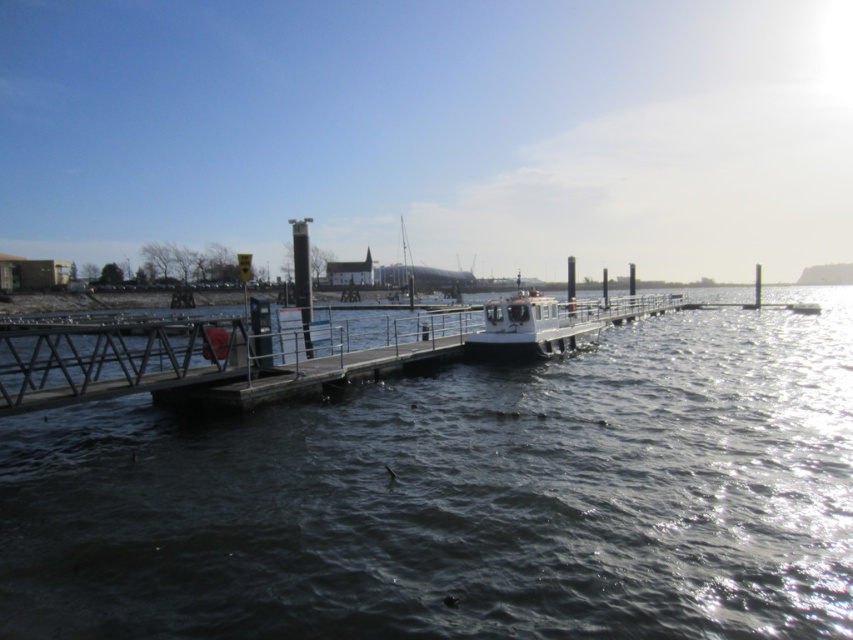
Is dark water at center thinner than white matte boat at center?

In fact, dark water at center might be wider than white matte boat at center.

Describe the element at coordinates (462, 499) in the screenshot. This screenshot has height=640, width=853. I see `dark water at center` at that location.

Between point (483, 435) and point (508, 314), which one is positioned in front?

Point (483, 435)

Where is `dark water at center`? Image resolution: width=853 pixels, height=640 pixels. dark water at center is located at coordinates (462, 499).